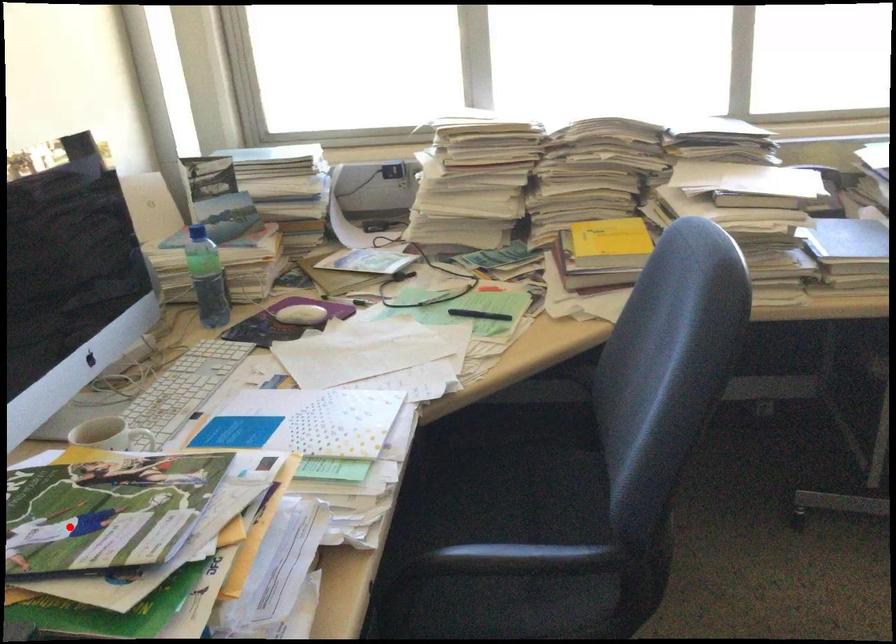
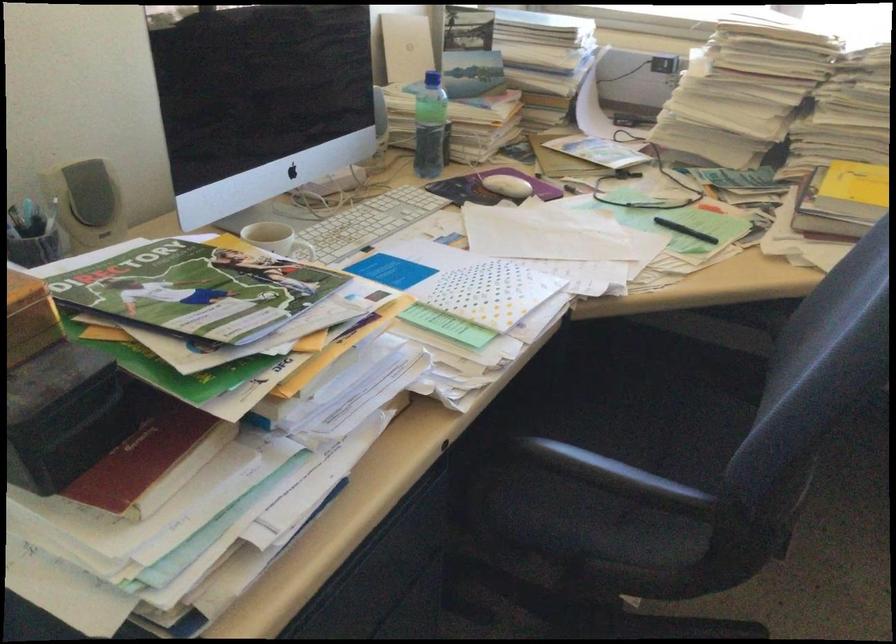
Question: I am providing you with two images of the same scene from different viewpoints. Image1 has a red point marked. In image2, the corresponding 3D location appears at what relative position? Reply with the corresponding letter.

Choices:
 (A) Closer
 (B) Farther

Answer: (B)